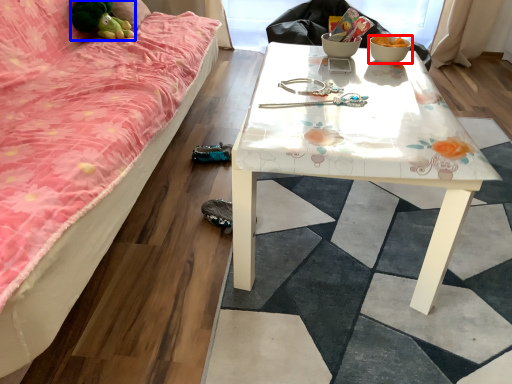
Question: Which object appears farthest to the camera in this image, bowl (highlighted by a red box) or toy (highlighted by a blue box)?

Choices:
 (A) bowl
 (B) toy

Answer: (B)